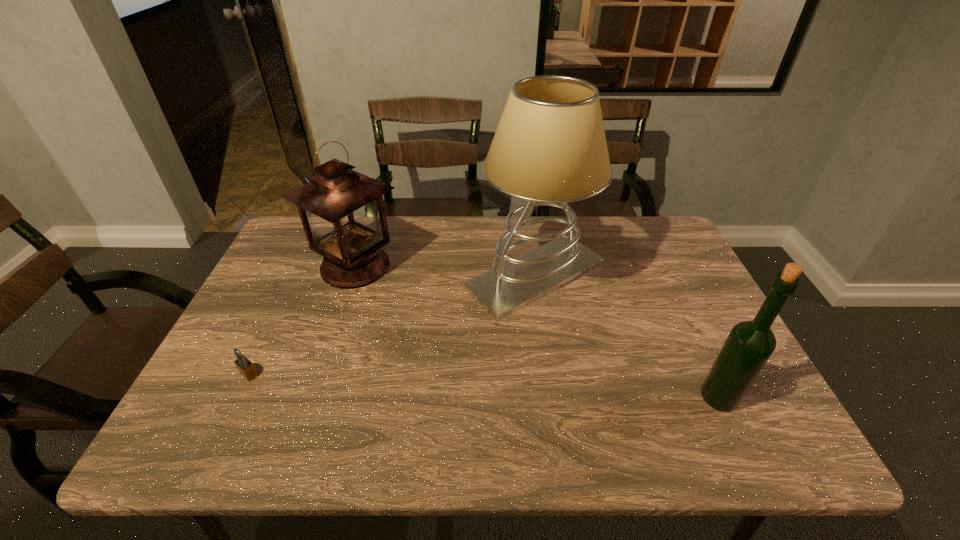
This screenshot has width=960, height=540. What are the coordinates of `the third object from left to right` in the screenshot? It's located at (549, 148).

This screenshot has width=960, height=540. What are the coordinates of `the tallest object` in the screenshot? It's located at (549, 148).

The image size is (960, 540). Identify the location of oil lamp. (342, 211).

In order to click on liquor in this screenshot , I will do `click(749, 345)`.

At what (x,y) coordinates should I click in order to perform the action: click on the nearest object. Please return your answer as a coordinate pair (x, y). The image size is (960, 540). Looking at the image, I should click on (749, 345).

At what (x,y) coordinates should I click in order to perform the action: click on the second nearest object. Please return your answer as a coordinate pair (x, y). Looking at the image, I should click on (246, 368).

Image resolution: width=960 pixels, height=540 pixels. Identify the location of the shortest object. (246, 368).

The height and width of the screenshot is (540, 960). Identify the location of free space located on the front of the third object from left to right. (555, 411).

Find the location of a particular element. The width and height of the screenshot is (960, 540). free spot located on the right of the oil lamp is located at coordinates (521, 266).

This screenshot has width=960, height=540. Identify the location of free space located on the back of the rightmost object. (673, 301).